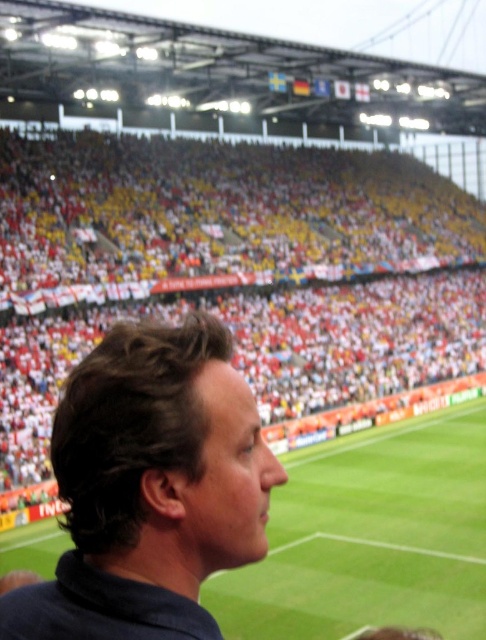
You are a photographer trying to capture a photo of the dark brown hair at center without the yellow fabric crowd at upper left blocking the view. Based on their sizes, can you position yourself in a way to avoid the obstruction?

The yellow fabric crowd at upper left is taller than dark brown hair at center, so positioning yourself lower or moving closer to the dark brown hair at center might help avoid the obstruction caused by the yellow fabric crowd at upper left.

You are a photographer standing at the edge of the stadium field. You want to take a photo that includes both the yellow fabric crowd at upper left and the dark brown hair at center. Given that your camera has a maximum zoom range of 30 meters, can you capture both subjects in a single frame without moving your position?

The yellow fabric crowd at upper left and dark brown hair at center are 38.57 meters apart from each other. Since the distance exceeds the camera maximum zoom range of 30 meters, you cannot capture both subjects in a single frame without moving your position.